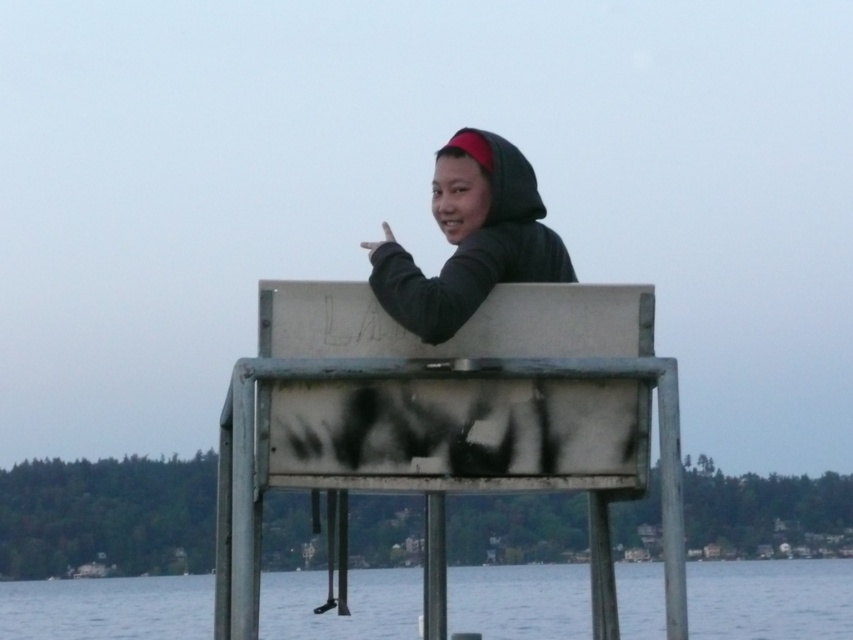
Does metallic gray dock at center have a greater height compared to black matte hoodie at upper center?

No.

How distant is metallic gray dock at center from black matte hoodie at upper center?

The distance of metallic gray dock at center from black matte hoodie at upper center is 1.94 meters.

Identify the location of metallic gray dock at center. The height and width of the screenshot is (640, 853). (448, 420).

In order to click on transparent water at lower center in this screenshot , I will do `click(769, 598)`.

From the picture: Does transparent water at lower center have a lesser height compared to black matte hoodie at upper center?

Incorrect, transparent water at lower center's height does not fall short of black matte hoodie at upper center's.

What do you see at coordinates (769, 598) in the screenshot? The width and height of the screenshot is (853, 640). I see `transparent water at lower center` at bounding box center [769, 598].

Where is `transparent water at lower center`? transparent water at lower center is located at coordinates (769, 598).

Is metallic gray dock at center shorter than transparent water at lower center?

Correct, metallic gray dock at center is not as tall as transparent water at lower center.

Is metallic gray dock at center bigger than transparent water at lower center?

No, metallic gray dock at center is not bigger than transparent water at lower center.

Find the location of a particular element. This screenshot has width=853, height=640. metallic gray dock at center is located at coordinates (448, 420).

Identify the location of metallic gray dock at center. (448, 420).